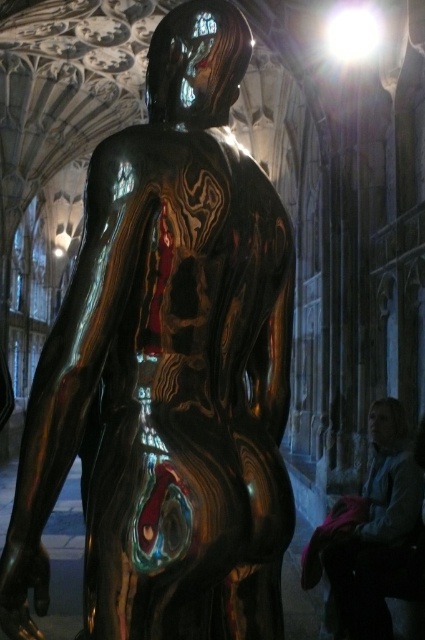
You are standing in the cathedral and want to know how far you are from the point marked as point (189,12) on the sculpture. Can you determine the distance?

The distance of point (189,12) from the viewer is 67.98 feet.

You are an art student analyzing the sculpture in the cathedral. You notice a specific point labeled as point (167, 369). Based on the description, where exactly on the sculpture would this point be located?

The point (167, 369) is located on the glossy bronze statue at center.

You are an art conservator who needs to clean the glossy bronze statue at center. Your cleaning equipment is placed 57.50 feet away from the statue. Can you reach the equipment without moving from your current position?

The distance between you and the glossy bronze statue at center is 57.50 feet. Since the equipment is placed 57.50 feet away from the statue, you would need to move towards the equipment to reach it.